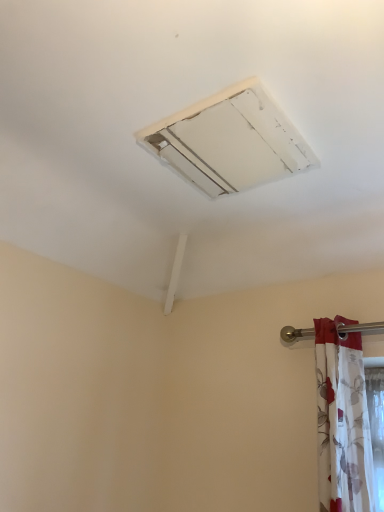
Question: Looking at their shapes, would you say white floral fabric at right is wider or thinner than white matte air conditioning at upper center?

Choices:
 (A) wide
 (B) thin

Answer: (B)

Question: Considering their positions, is white floral fabric at right located in front of or behind white matte air conditioning at upper center?

Choices:
 (A) front
 (B) behind

Answer: (B)

Question: Considering the positions of point (344, 402) and point (218, 188), is point (344, 402) closer or farther from the camera than point (218, 188)?

Choices:
 (A) farther
 (B) closer

Answer: (B)

Question: From a real-world perspective, is white matte air conditioning at upper center above or below white floral fabric at right?

Choices:
 (A) below
 (B) above

Answer: (B)

Question: Is white matte air conditioning at upper center bigger or smaller than white floral fabric at right?

Choices:
 (A) small
 (B) big

Answer: (A)

Question: Considering the positions of white matte air conditioning at upper center and white floral fabric at right in the image, is white matte air conditioning at upper center wider or thinner than white floral fabric at right?

Choices:
 (A) wide
 (B) thin

Answer: (A)

Question: Is white matte air conditioning at upper center taller or shorter than white floral fabric at right?

Choices:
 (A) short
 (B) tall

Answer: (A)